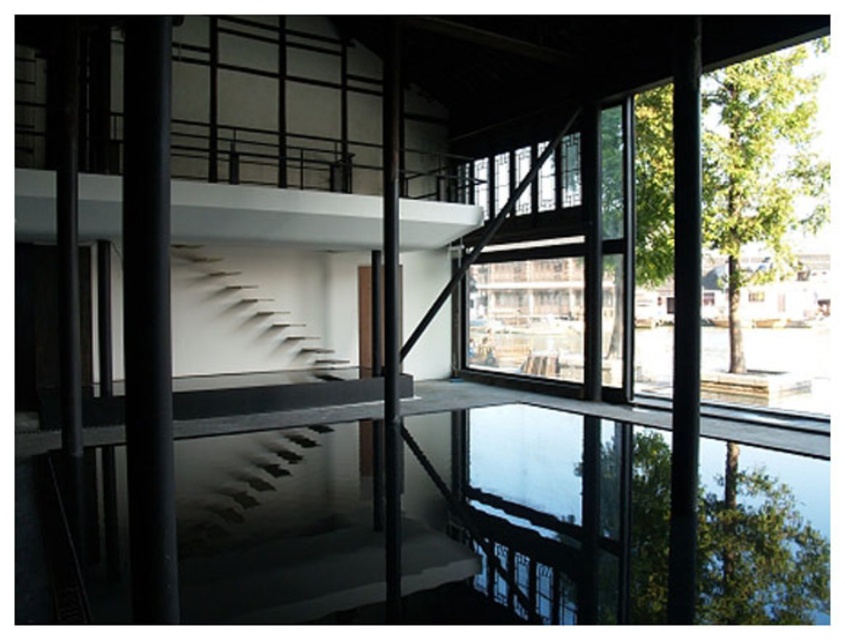
Question: Which object is closer to the camera taking this photo?

Choices:
 (A) white matte stairs at center
 (B) transparent glass pool at center

Answer: (B)

Question: Which of the following is the farthest from the observer?

Choices:
 (A) (544, 172)
 (B) (178, 268)
 (C) (549, 502)

Answer: (A)

Question: Can you confirm if transparent glass pool at center is positioned to the right of white matte stairs at center?

Choices:
 (A) no
 (B) yes

Answer: (B)

Question: Can you confirm if white matte stairs at center is positioned to the right of clear glass window at center?

Choices:
 (A) no
 (B) yes

Answer: (A)

Question: Which of the following is the closest to the observer?

Choices:
 (A) (326, 509)
 (B) (326, 364)
 (C) (548, 188)

Answer: (A)

Question: Can you confirm if transparent glass pool at center is positioned to the left of white matte stairs at center?

Choices:
 (A) yes
 (B) no

Answer: (B)